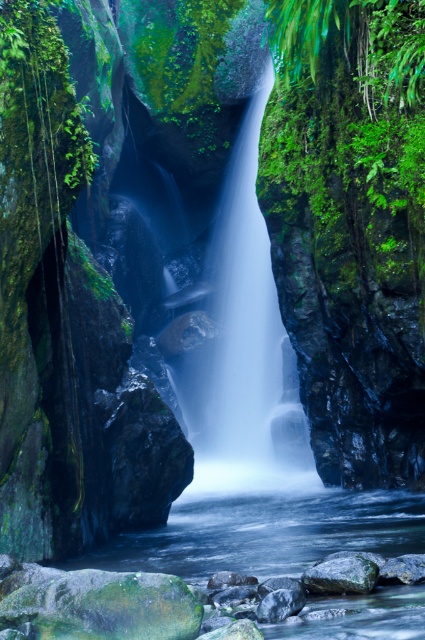
Question: Among these objects, which one is farthest from the camera?

Choices:
 (A) clear water at center
 (B) green mossy rock at lower center

Answer: (B)

Question: Is white misty waterfall at center behind green mossy rock at lower center?

Choices:
 (A) yes
 (B) no

Answer: (A)

Question: Which of the following is the farthest from the observer?

Choices:
 (A) clear water at center
 (B) white misty waterfall at center
 (C) green mossy rock at lower center

Answer: (B)

Question: Estimate the real-world distances between objects in this image. Which object is farther from the white misty waterfall at center?

Choices:
 (A) green mossy rock at lower center
 (B) clear water at center

Answer: (A)

Question: Is white misty waterfall at center to the right of clear water at center from the viewer's perspective?

Choices:
 (A) yes
 (B) no

Answer: (B)

Question: Can you confirm if white misty waterfall at center is smaller than clear water at center?

Choices:
 (A) no
 (B) yes

Answer: (A)